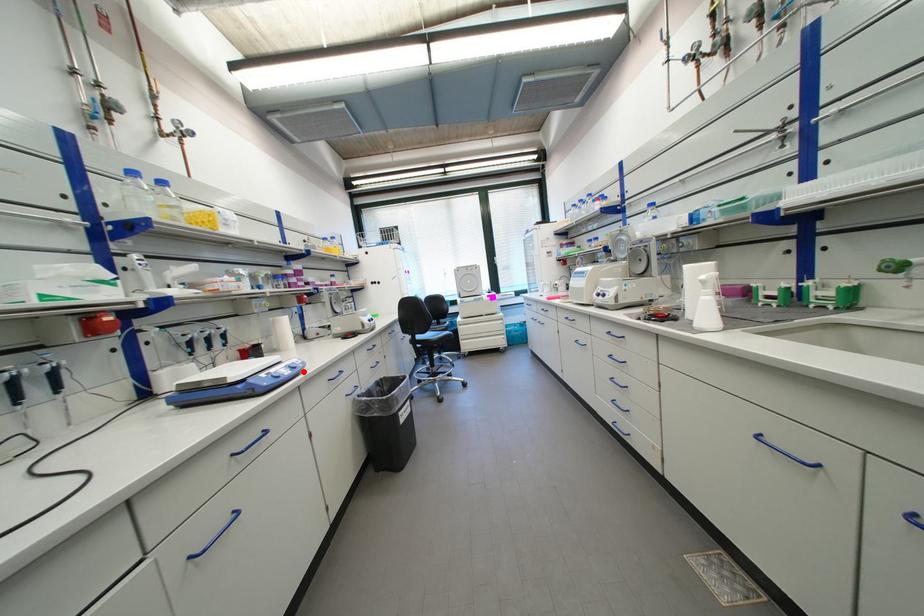
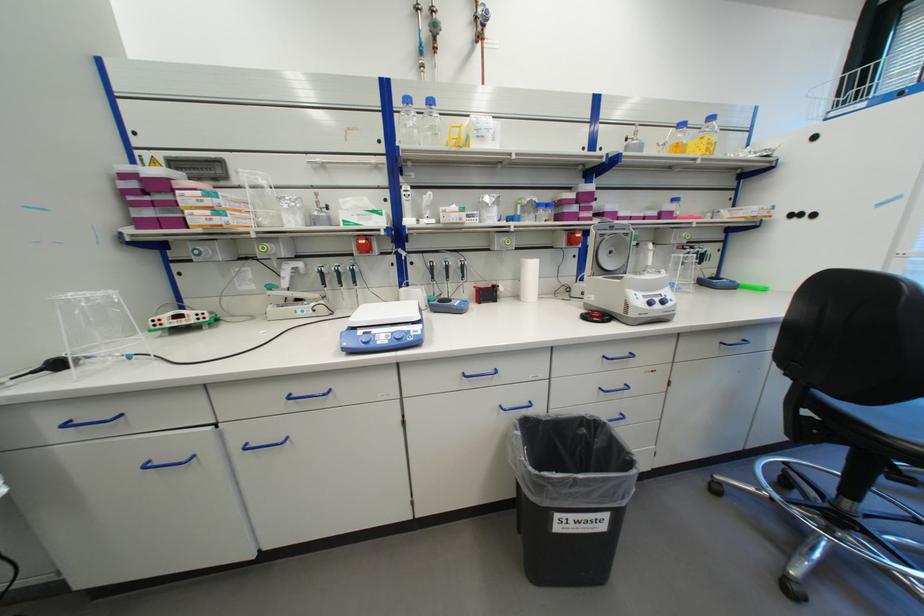
In the second image, find the point that corresponds to the highlighted location in the first image.

(405, 344)